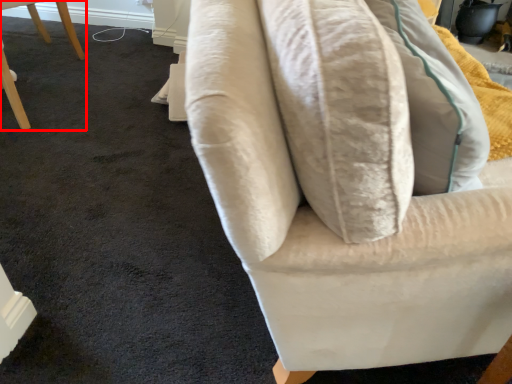
Question: From the image's perspective, where is chair (annotated by the red box) located relative to furniture?

Choices:
 (A) above
 (B) below

Answer: (A)